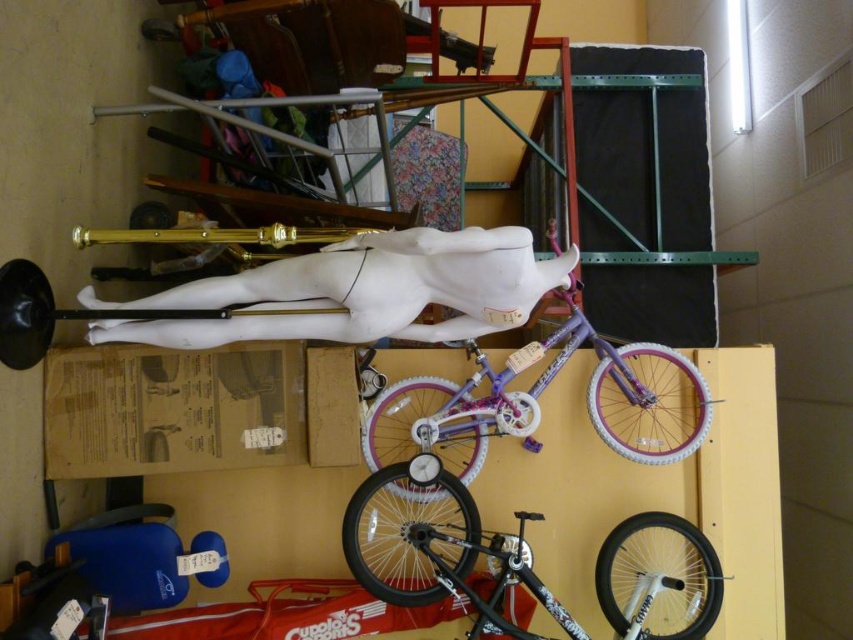
You are a delivery person who needs to place a new item in the storage area. The storage area has a purple bicycle with white tires and pink accents on a yellow surface and a white marble statue at center. According to the layout, where should you place the new item to ensure it doesn

The white marble statue at center is located at point (357,291), so you should place the new item away from that coordinate to avoid blocking the statue.

You are standing in the storage area and need to move the shiny black bicycle at center. To do so, you must first determine if there is enough space between the white marble statue at center and the wall behind it. Can you confirm if the statue is closer to you or the wall?

The white marble statue at center is closer to the viewer than the shiny black bicycle at center, so the statue is closer to you than the wall. Therefore, there is enough space between the statue and the wall to move the bicycle.